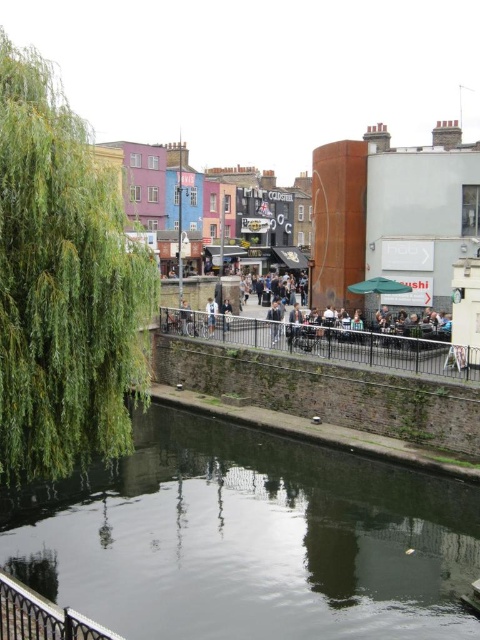
In the scene shown: You are a tourist standing on the walkway above the canal and want to take a photo of both the dark reflective water at center and the black metal rail at center. Which object will appear bigger in your photo?

The dark reflective water at center will appear bigger in the photo because it is larger in size than the black metal rail at center.

You are a tourist standing on the walkway near the black metal rail at center, and you want to take a photo of the green leafy tree at left. If your camera can focus on objects up to 25 meters away, will you be able to capture the tree clearly?

The green leafy tree at left is 20.63 meters from the black metal rail at center. Since your camera can focus up to 25 meters, you can capture the tree clearly as the distance is within range.

You are a tourist standing on the walkway above the canal. You notice the green leafy tree at left and the white fabric at center. Which object is closer to the water surface?

The green leafy tree at left is positioned under the white fabric at center, so it is closer to the water surface than the white fabric at center.